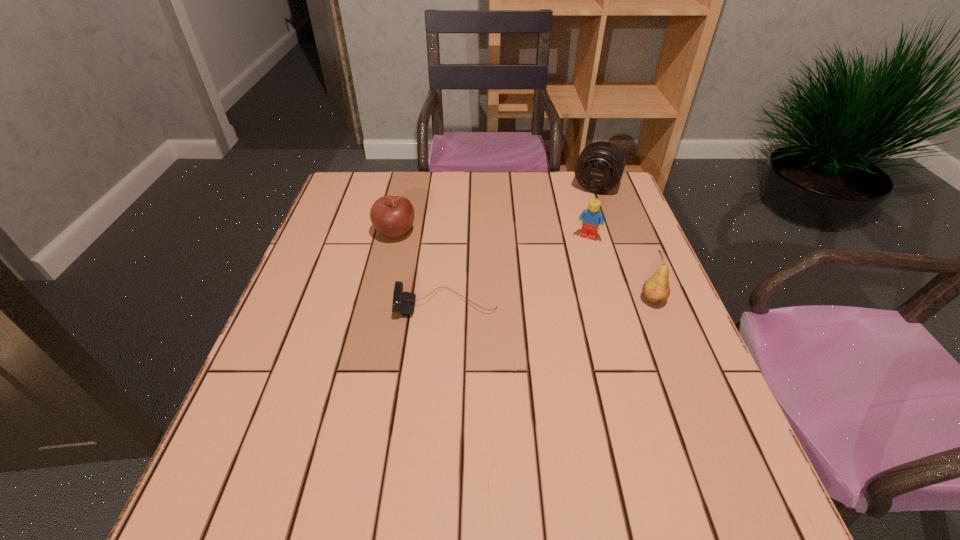
The width and height of the screenshot is (960, 540). In order to click on the shortest object in this screenshot , I will do `click(404, 302)`.

This screenshot has width=960, height=540. Identify the location of pear. (656, 290).

The image size is (960, 540). What are the coordinates of `telephoto lens` in the screenshot? It's located at (600, 166).

The image size is (960, 540). In order to click on Lego in this screenshot , I will do `click(592, 217)`.

Locate an element on the screen. Image resolution: width=960 pixels, height=540 pixels. the second shortest object is located at coordinates (392, 216).

The width and height of the screenshot is (960, 540). I want to click on free spot located on the front-facing side of the webcam, so click(343, 305).

At what (x,y) coordinates should I click in order to perform the action: click on free space located on the front-facing side of the webcam. Please return your answer as a coordinate pair (x, y). The image size is (960, 540). Looking at the image, I should click on (373, 305).

Find the location of a particular element. free point located 0.110m on the front-facing side of the webcam is located at coordinates (348, 305).

Find the location of a particular element. The image size is (960, 540). free spot located 0.180m on the front of the pear is located at coordinates (684, 377).

Find the location of a particular element. Image resolution: width=960 pixels, height=540 pixels. free space located 0.140m on the front-facing side of the farthest object is located at coordinates tap(581, 223).